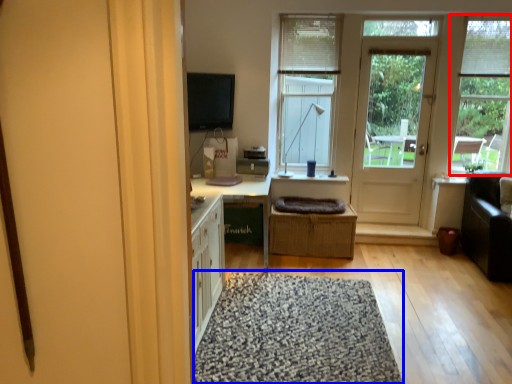
Question: Among these objects, which one is farthest to the camera, window (highlighted by a red box) or doormat (highlighted by a blue box)?

Choices:
 (A) window
 (B) doormat

Answer: (A)